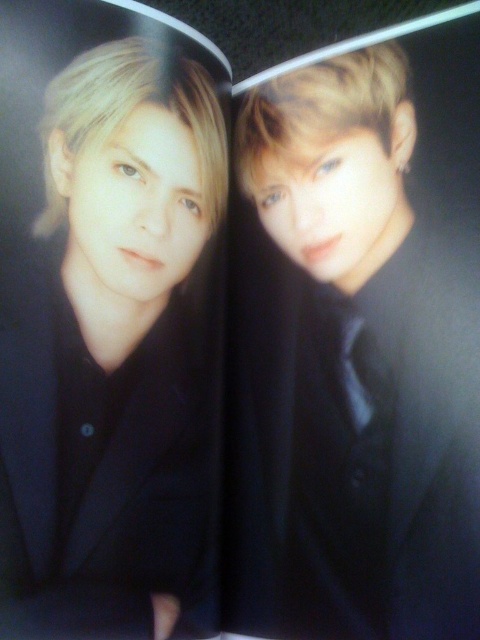
Which of these two, matte black jacket at left or black satin business suit at center, stands taller?

matte black jacket at left is taller.

Locate an element on the screen. matte black jacket at left is located at coordinates (113, 355).

Find the location of a particular element. The height and width of the screenshot is (640, 480). matte black jacket at left is located at coordinates (113, 355).